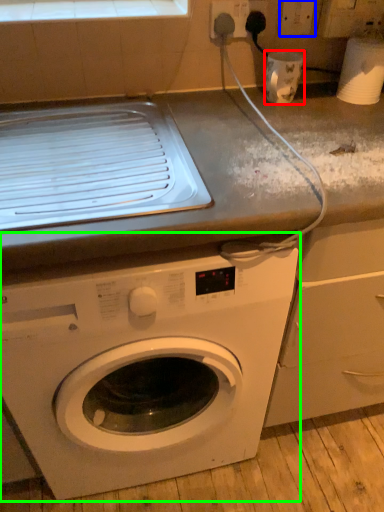
Question: Which is farther away from appliance (highlighted by a red box)? electric outlet (highlighted by a blue box) or washing machine (highlighted by a green box)?

Choices:
 (A) electric outlet
 (B) washing machine

Answer: (B)